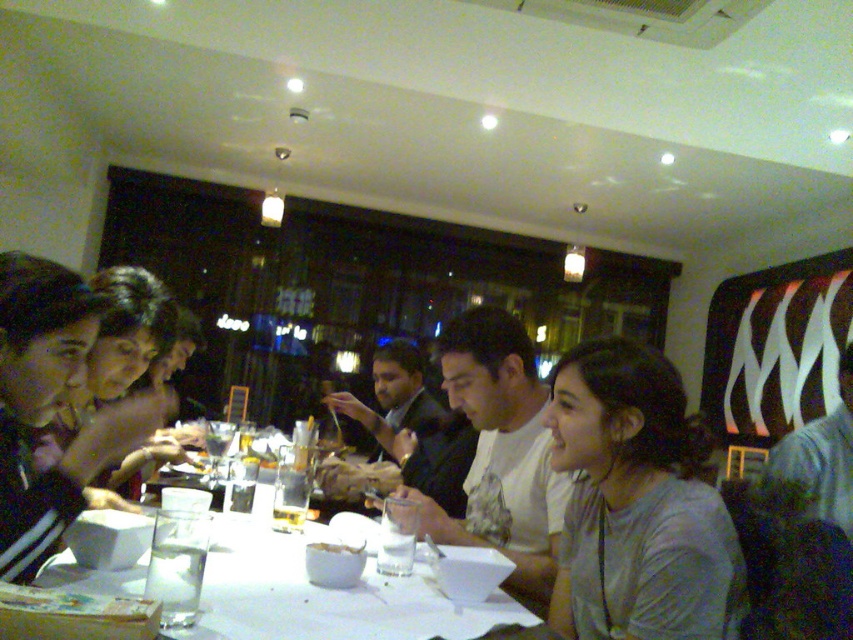
Which is more to the left, denim shirt at lower right or white matte bowl at center?

white matte bowl at center is more to the left.

Is point (834, 508) behind point (320, 548)?

Yes, point (834, 508) is behind point (320, 548).

I want to click on denim shirt at lower right, so click(x=822, y=456).

Identify the location of denim shirt at lower right. (822, 456).

Can you confirm if dark gray shirt at center is taller than white matte bowl at center?

Yes.

Does dark gray shirt at center come in front of white matte bowl at center?

No, dark gray shirt at center is further to the viewer.

You are a GUI agent. You are given a task and a screenshot of the screen. Output one action in this format:
    pyautogui.click(x=<x>, y=<y>)
    Task: Click on the dark gray shirt at center
    This screenshot has height=640, width=853.
    Given the screenshot: What is the action you would take?
    pyautogui.click(x=415, y=424)

Can you confirm if gray matte shirt at center is positioned above white matte bowl at center?

Yes.

Which of these two, gray matte shirt at center or white matte bowl at center, stands taller?

Standing taller between the two is gray matte shirt at center.

Between point (722, 545) and point (309, 548), which one is positioned in front?

Point (722, 545) is in front.

I want to click on gray matte shirt at center, so click(x=637, y=504).